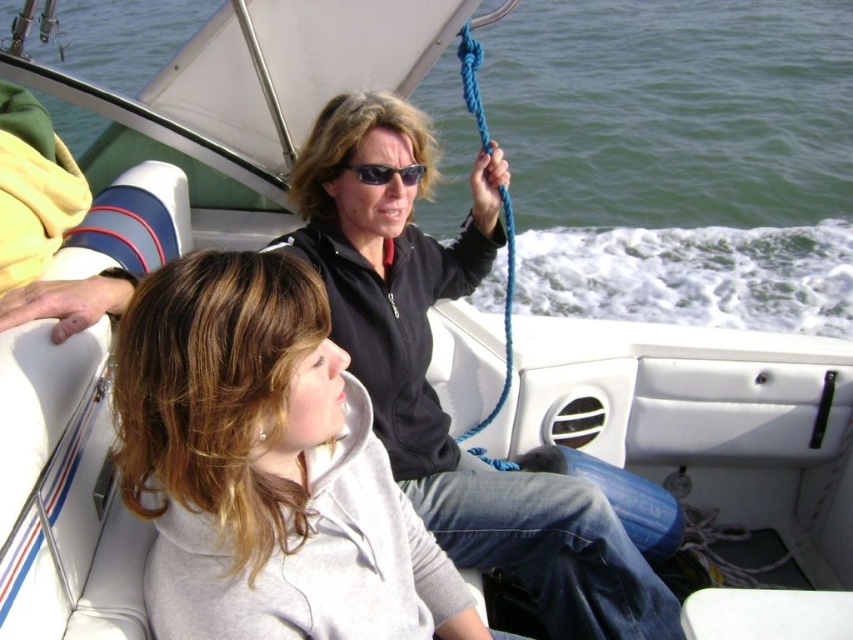
Question: Is black matte jacket at upper center thinner than black plastic sunglasses at center?

Choices:
 (A) no
 (B) yes

Answer: (A)

Question: Which point appears closest to the camera in this image?

Choices:
 (A) (363, 180)
 (B) (561, 566)
 (C) (430, 570)

Answer: (C)

Question: Which point is farther to the camera?

Choices:
 (A) black plastic sunglasses at center
 (B) gray fleece jacket at center
 (C) black matte jacket at upper center

Answer: (A)

Question: Can you confirm if gray fleece jacket at center is bigger than black plastic sunglasses at center?

Choices:
 (A) yes
 (B) no

Answer: (A)

Question: Which point is farther to the camera?

Choices:
 (A) tap(404, 182)
 (B) tap(354, 529)
 (C) tap(491, 252)

Answer: (C)

Question: Is gray fleece jacket at center to the right of black matte jacket at upper center from the viewer's perspective?

Choices:
 (A) no
 (B) yes

Answer: (A)